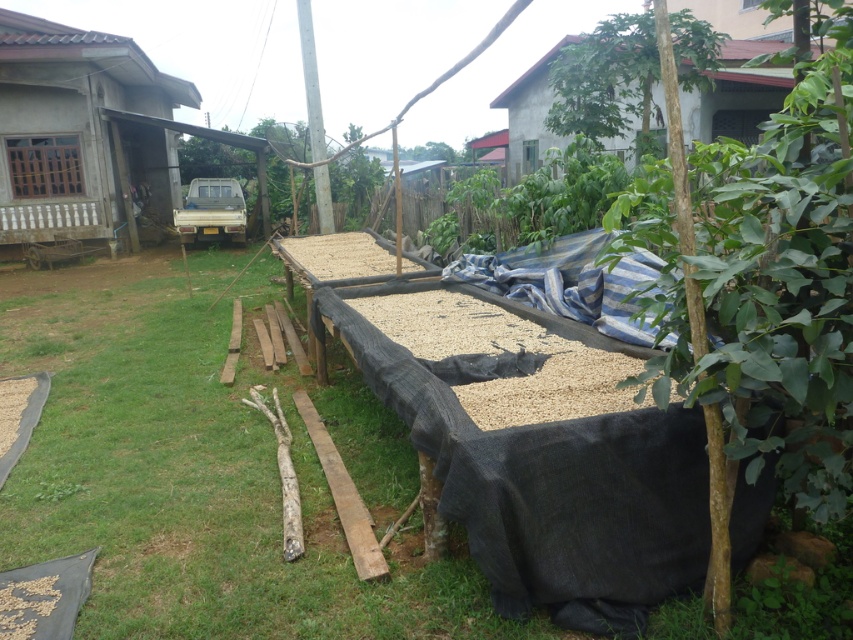
Identify the location of green leafy tree at upper center. (606, 81).

Which of these two, green leafy tree at upper center or gray concrete hut at upper center, stands taller?

gray concrete hut at upper center

What do you see at coordinates (606, 81) in the screenshot? I see `green leafy tree at upper center` at bounding box center [606, 81].

Locate an element on the screen. Image resolution: width=853 pixels, height=640 pixels. green leafy tree at upper center is located at coordinates (606, 81).

This screenshot has height=640, width=853. Identify the location of green grass at center. (210, 467).

Who is taller, green grass at center or gray concrete hut at upper center?

gray concrete hut at upper center

Is point (427, 576) farther from viewer compared to point (752, 99)?

No.

The width and height of the screenshot is (853, 640). Identify the location of green grass at center. (210, 467).

Find the location of a particular element. The height and width of the screenshot is (640, 853). green grass at center is located at coordinates (x=210, y=467).

Which of these two, green grass at center or green leafy tree at upper center, stands taller?

Standing taller between the two is green leafy tree at upper center.

The height and width of the screenshot is (640, 853). Find the location of `green grass at center`. green grass at center is located at coordinates (210, 467).